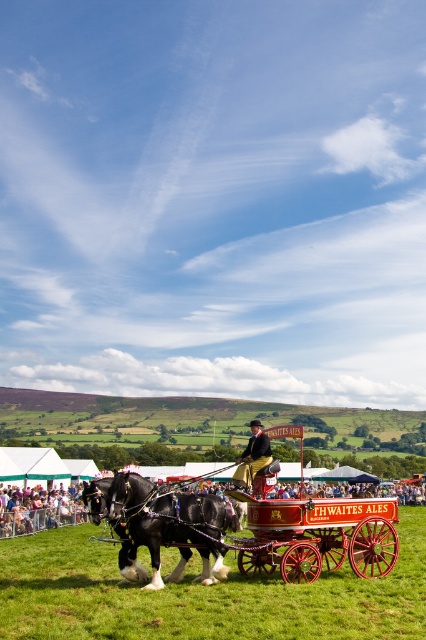
In the scene of the rural fair, there is a smooth skin person at lower left and a smooth brown leather jacket at center. Which object is positioned more to the left?

The smooth skin person at lower left is positioned more to the left than the smooth brown leather jacket at center.

You are a photographer wanting to capture the shiny black horse at center and the green grassy field at center in a single shot. Which object should you focus on first to ensure both are in frame?

The green grassy field at center is in front of the shiny black horse at center, so you should focus on the shiny black horse at center first to ensure both are in frame.

You are standing at the origin point of the image coordinate system. You see two points, point (x=380, y=499) and point (x=241, y=470). Which point is closer to you?

Point (x=241, y=470) is closer to you because it is in front of point (x=380, y=499).